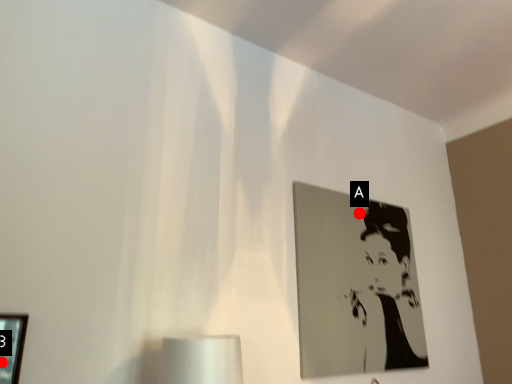
Question: Two points are circled on the image, labeled by A and B beside each circle. Which point is further to the camera?

Choices:
 (A) A is further
 (B) B is further

Answer: (A)